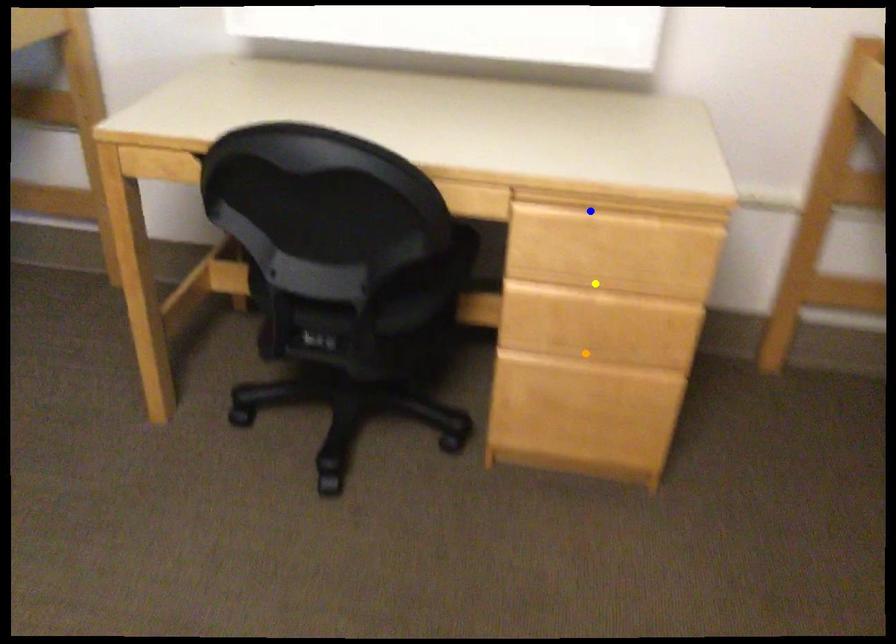
Order these from nearest to farthest:
yellow point | blue point | orange point

blue point → yellow point → orange point